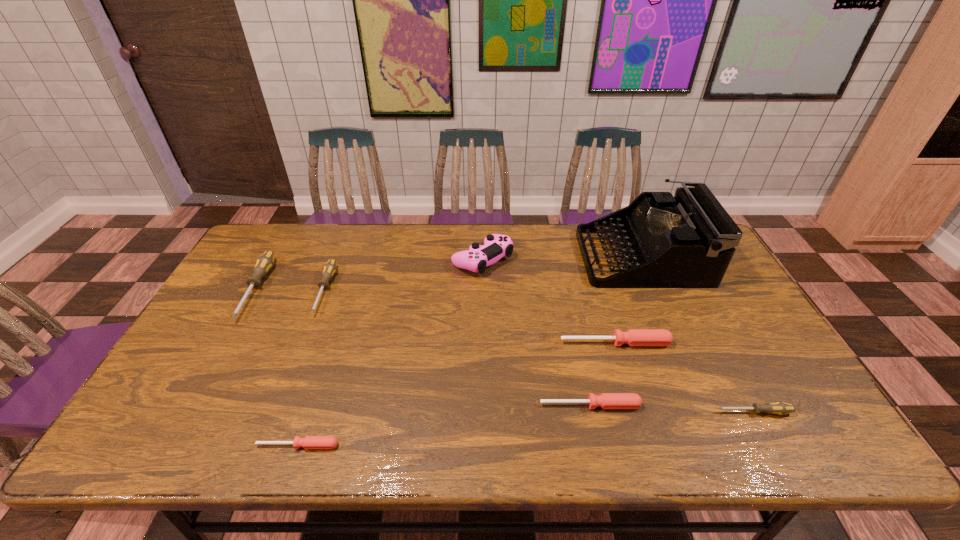
This screenshot has height=540, width=960. Identify the location of typewriter. (687, 241).

You are a GUI agent. You are given a task and a screenshot of the screen. Output one action in this format:
    pyautogui.click(x=<x>, y=<y>)
    Task: Click on the tallest object
    The image size is (960, 540).
    Given the screenshot: What is the action you would take?
    pyautogui.click(x=687, y=241)

The height and width of the screenshot is (540, 960). Identify the location of the fifth object from right to left. (476, 259).

I want to click on the second tallest object, so click(476, 259).

Where is `the leftmost object`? the leftmost object is located at coordinates (264, 263).

You are a GUI agent. You are given a task and a screenshot of the screen. Output one action in this format:
    pyautogui.click(x=<x>, y=<y>)
    Task: Click on the biggest gray screwdriver
    The image size is (960, 540).
    Given the screenshot: What is the action you would take?
    point(264,263)

The image size is (960, 540). Identify the location of the second smallest gray screwdriver. (329, 269).

In order to click on the farthest red screwdriver in this screenshot , I will do `click(633, 337)`.

Identify the location of the third farthest screwdriver. point(633,337).

Locate an element on the screen. This screenshot has height=540, width=960. the second biggest red screwdriver is located at coordinates (606, 400).